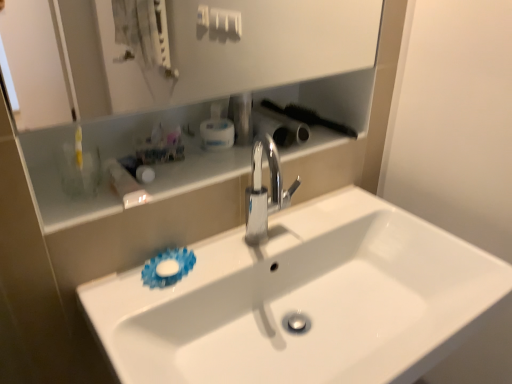
Where is `translucent plastic container at upper left, the 1th toiletry when ordered from bottom to top`? This screenshot has width=512, height=384. translucent plastic container at upper left, the 1th toiletry when ordered from bottom to top is located at coordinates (124, 184).

What is the approximate height of polished chrome faucet at center?

polished chrome faucet at center is 9.64 inches in height.

This screenshot has height=384, width=512. Describe the element at coordinates (264, 190) in the screenshot. I see `polished chrome faucet at center` at that location.

In order to face metallic silver toothbrush at upper center, the first toiletry viewed from the back, should I rotate leftwards or rightwards?

To align with it, rotate left about 1.269°.

Find the location of a particular element. black plastic brush at upper right, which is the 1th brush in right-to-left order is located at coordinates (309, 117).

What is the approximate width of white glossy sink at center?

It is 18.46 inches.

The height and width of the screenshot is (384, 512). I want to click on white plastic mouthwash at upper center, so click(217, 130).

Where is `translucent plastic container at upper left, positioned as the second toiletry in right-to-left order`? translucent plastic container at upper left, positioned as the second toiletry in right-to-left order is located at coordinates (124, 184).

Which is more to the right, metallic silver toothbrush at upper center, which ranks as the 2th toiletry in bottom-to-top order, or white glossy shelf at upper center?

metallic silver toothbrush at upper center, which ranks as the 2th toiletry in bottom-to-top order.

From the image's perspective, between metallic silver toothbrush at upper center, which ranks as the 2th toiletry in bottom-to-top order, and white glossy shelf at upper center, which one is located above?

metallic silver toothbrush at upper center, which ranks as the 2th toiletry in bottom-to-top order, from the image's perspective.

Looking at this image, is polished chrome faucet at center turned away from translucent plastic container at upper left, the 1th toiletry when ordered from bottom to top?

No.

Does polished chrome faucet at center have a greater width compared to translucent plastic container at upper left, the 1th toiletry when ordered from bottom to top?

In fact, polished chrome faucet at center might be narrower than translucent plastic container at upper left, the 1th toiletry when ordered from bottom to top.

Can you tell me how much polished chrome faucet at center and translucent plastic container at upper left, placed as the second toiletry when sorted from back to front, differ in facing direction?

The angle between the facing direction of polished chrome faucet at center and the facing direction of translucent plastic container at upper left, placed as the second toiletry when sorted from back to front, is 0.000426 degrees.

From their relative heights in the image, would you say polished chrome faucet at center is taller or shorter than translucent plastic container at upper left, marked as the 1th toiletry in a front-to-back arrangement?

In the image, polished chrome faucet at center appears to be taller than translucent plastic container at upper left, marked as the 1th toiletry in a front-to-back arrangement.

From a real-world perspective, who is located lower, black plastic brush at upper right, which is the 1th brush in right-to-left order, or white glossy shelf at upper center?

white glossy shelf at upper center, from a real-world perspective.

In terms of width, does black plastic brush at upper right, the second brush positioned from the left, look wider or thinner when compared to white glossy shelf at upper center?

In the image, black plastic brush at upper right, the second brush positioned from the left, appears to be wider than white glossy shelf at upper center.

Looking at this image, from the image's perspective, who appears lower, white glossy sink at center or white glossy shelf at upper center?

white glossy sink at center.

Is white glossy sink at center to the left or to the right of white glossy shelf at upper center in the image?

In the image, white glossy sink at center appears on the right side of white glossy shelf at upper center.

Can you tell me how much white glossy sink at center and white glossy shelf at upper center differ in facing direction?

0.103 degrees separate the facing orientations of white glossy sink at center and white glossy shelf at upper center.

This screenshot has height=384, width=512. In order to click on shelve above the white glossy sink at center (from a real-world perspective) in this screenshot , I will do `click(170, 162)`.

Which object is closer to the camera, black plastic brush at upper right, which is the 2th brush from right to left, or white glossy shelf at upper center?

Positioned in front is white glossy shelf at upper center.

Does point (272, 101) appear closer or farther from the camera than point (53, 205)?

Point (272, 101).

Is black plastic brush at upper right, which is the 2th brush from right to left, bigger than white glossy shelf at upper center?

No.

Does metallic silver toothbrush at upper center, which is the first toiletry from right to left, contain translucent plastic container at upper left, the 1th toiletry when ordered from bottom to top?

Definitely not — translucent plastic container at upper left, the 1th toiletry when ordered from bottom to top, is not inside metallic silver toothbrush at upper center, which is the first toiletry from right to left.

Does metallic silver toothbrush at upper center, the second toiletry when ordered from left to right, lie behind translucent plastic container at upper left, which is the second toiletry from top to bottom?

Yes, it is behind translucent plastic container at upper left, which is the second toiletry from top to bottom.

From the image's perspective, who appears lower, metallic silver toothbrush at upper center, the second toiletry when ordered from left to right, or translucent plastic container at upper left, the 1th toiletry when ordered from bottom to top?

translucent plastic container at upper left, the 1th toiletry when ordered from bottom to top, appears lower in the image.

From a real-world perspective, between white glossy shelf at upper center and black plastic brush at upper right, which is the 1th brush in right-to-left order, who is vertically higher?

black plastic brush at upper right, which is the 1th brush in right-to-left order, from a real-world perspective.

Does white glossy shelf at upper center have a lesser width compared to black plastic brush at upper right, which is the 1th brush in right-to-left order?

Correct, the width of white glossy shelf at upper center is less than that of black plastic brush at upper right, which is the 1th brush in right-to-left order.

Who is smaller, white glossy shelf at upper center or black plastic brush at upper right, which is the 1th brush in right-to-left order?

black plastic brush at upper right, which is the 1th brush in right-to-left order, is smaller.

From their relative heights in the image, would you say white glossy shelf at upper center is taller or shorter than black plastic brush at upper right, which is the 1th brush in right-to-left order?

Considering their sizes, white glossy shelf at upper center has less height than black plastic brush at upper right, which is the 1th brush in right-to-left order.

Where is `shelve below the metallic silver toothbrush at upper center, which is the first toiletry from right to left (from a real-world perspective)`? The width and height of the screenshot is (512, 384). shelve below the metallic silver toothbrush at upper center, which is the first toiletry from right to left (from a real-world perspective) is located at coordinates (170, 162).

From the image's perspective, which toiletry is the 1st one above the polished chrome faucet at center? Please provide its 2D coordinates.

[(124, 184)]

Based on their spatial positions, is metallic silver toothbrush at upper center, the second toiletry when ordered from front to back, or white plastic mouthwash at upper center closer to black plastic brush at upper right, placed as the first brush when sorted from left to right?

metallic silver toothbrush at upper center, the second toiletry when ordered from front to back.

Based on the photo, which object lies nearer to the anchor point metallic silver toothbrush at upper center, which is the first toiletry from right to left, translucent plastic container at upper left, the 1th toiletry when ordered from bottom to top, or white plastic mouthwash at upper center?

Based on the image, white plastic mouthwash at upper center appears to be nearer to metallic silver toothbrush at upper center, which is the first toiletry from right to left.

Based on their spatial positions, is white glossy sink at center or white plastic mouthwash at upper center further from metallic silver toothbrush at upper center, the first toiletry viewed from the back?

white glossy sink at center lies further to metallic silver toothbrush at upper center, the first toiletry viewed from the back, than the other object.

Consider the image. Which object lies further to the anchor point black plastic brush at upper right, placed as the first brush when sorted from left to right, white glossy shelf at upper center or metallic silver toothbrush at upper center, the second toiletry when ordered from front to back?

white glossy shelf at upper center is positioned further to the anchor black plastic brush at upper right, placed as the first brush when sorted from left to right.

Considering their positions, is black plastic brush at upper right, which is the 2th brush from right to left, positioned further to translucent plastic container at upper left, positioned as the second toiletry in right-to-left order, than black plastic brush at upper right, which is the 1th brush in right-to-left order?

black plastic brush at upper right, which is the 1th brush in right-to-left order, is positioned further to the anchor translucent plastic container at upper left, positioned as the second toiletry in right-to-left order.

Considering their positions, is white glossy shelf at upper center positioned further to black plastic brush at upper right, which is the 1th brush in right-to-left order, than white plastic mouthwash at upper center?

Based on the image, white glossy shelf at upper center appears to be further to black plastic brush at upper right, which is the 1th brush in right-to-left order.

Which object lies further to the anchor point black plastic brush at upper right, which is the 2th brush from right to left, metallic silver toothbrush at upper center, the second toiletry when ordered from front to back, or white glossy sink at center?

Among the two, white glossy sink at center is located further to black plastic brush at upper right, which is the 2th brush from right to left.

When comparing their distances from metallic silver toothbrush at upper center, which ranks as the 2th toiletry in bottom-to-top order, does black plastic brush at upper right, the second brush positioned from the left, or black plastic brush at upper right, placed as the first brush when sorted from left to right, seem further?

black plastic brush at upper right, the second brush positioned from the left, lies further to metallic silver toothbrush at upper center, which ranks as the 2th toiletry in bottom-to-top order, than the other object.

The width and height of the screenshot is (512, 384). I want to click on mouthwash between translucent plastic container at upper left, the first toiletry in the left-to-right sequence, and polished chrome faucet at center, in the horizontal direction, so click(x=217, y=130).

Image resolution: width=512 pixels, height=384 pixels. Find the location of `shelve between translucent plastic container at upper left, the 1th toiletry when ordered from bottom to top, and polished chrome faucet at center from left to right`. shelve between translucent plastic container at upper left, the 1th toiletry when ordered from bottom to top, and polished chrome faucet at center from left to right is located at coordinates (170, 162).

Locate an element on the screen. The width and height of the screenshot is (512, 384). tap between white glossy shelf at upper center and black plastic brush at upper right, which is the 1th brush in right-to-left order, along the z-axis is located at coordinates [264, 190].

Locate an element on the screen. The width and height of the screenshot is (512, 384). mouthwash between white glossy sink at center and black plastic brush at upper right, placed as the first brush when sorted from left to right, from front to back is located at coordinates (217, 130).